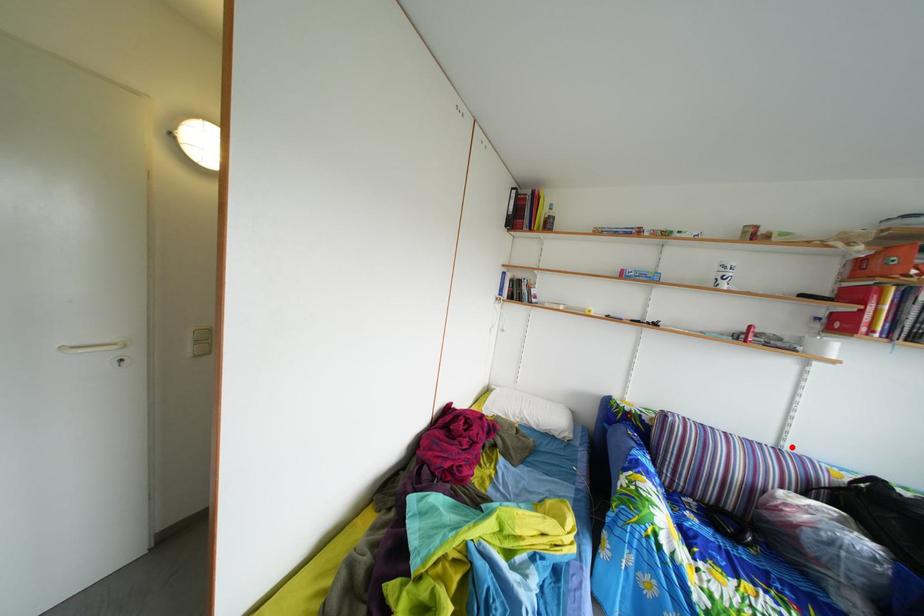
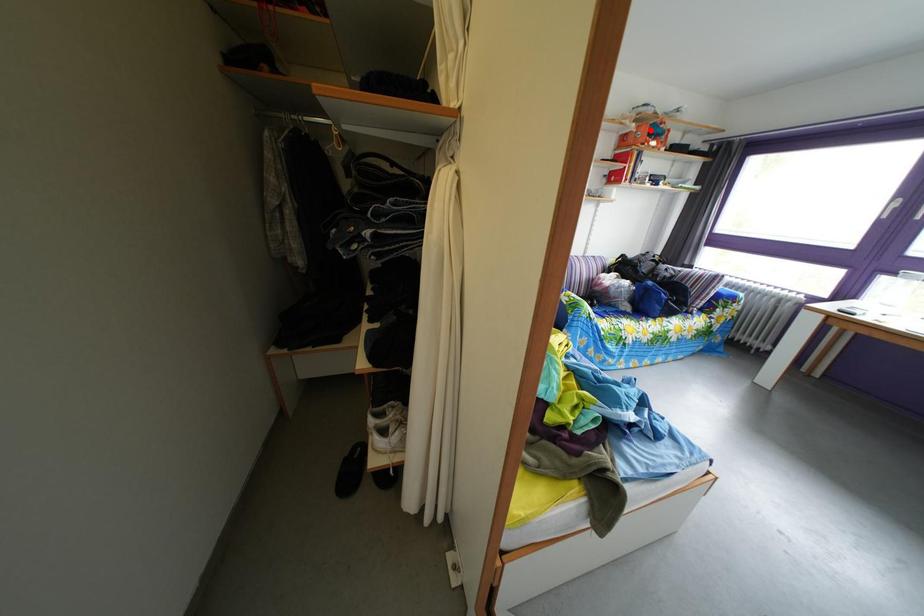
I am providing you with two images of the same scene from different viewpoints. A red point is marked on the first image and another point is marked on the second image. Is the red point in image1 aligned with the point shown in image2?

No